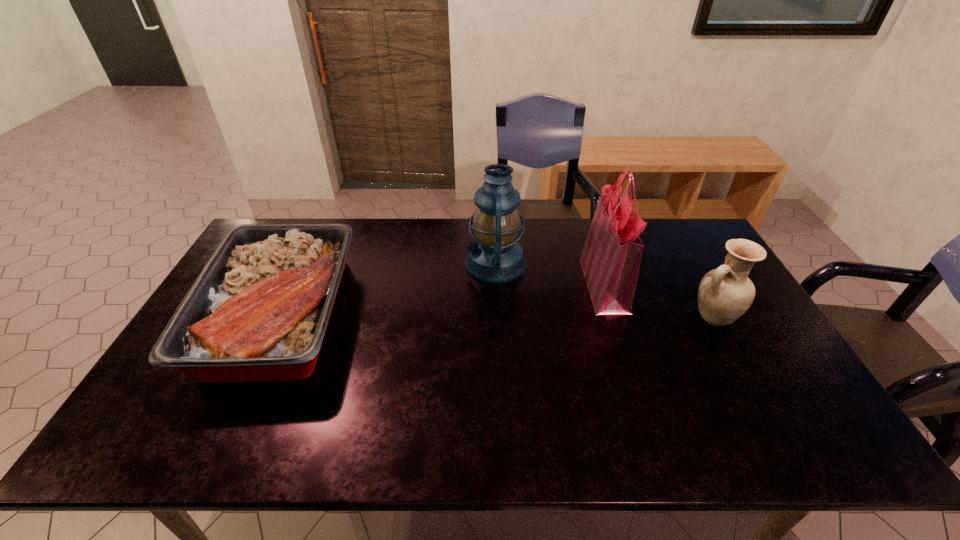
Find the location of a particular element. The image size is (960, 540). object that is the third closest to the shopping bag is located at coordinates (258, 311).

Locate an element on the screen. The image size is (960, 540). free location that satisfies the following two spatial constraints: 1. on the face of the lantern; 2. on the right side of the shopping bag is located at coordinates pyautogui.click(x=496, y=284).

The height and width of the screenshot is (540, 960). Identify the location of vacant space that satisfies the following two spatial constraints: 1. on the face of the third object from right to left; 2. on the left side of the shopping bag. (496, 284).

Where is `free point that satisfies the following two spatial constraints: 1. on the back side of the leftmost object; 2. on the left side of the second object from right to left`? free point that satisfies the following two spatial constraints: 1. on the back side of the leftmost object; 2. on the left side of the second object from right to left is located at coordinates (295, 284).

At what (x,y) coordinates should I click in order to perform the action: click on free location that satisfies the following two spatial constraints: 1. on the front side of the rightmost object; 2. on the left side of the shortest object. Please return your answer as a coordinate pair (x, y). Looking at the image, I should click on (278, 316).

At what (x,y) coordinates should I click in order to perform the action: click on free space that satisfies the following two spatial constraints: 1. on the front side of the second object from right to left; 2. on the left side of the rightmost object. Please return your answer as a coordinate pair (x, y). This screenshot has height=540, width=960. Looking at the image, I should click on (614, 316).

You are a GUI agent. You are given a task and a screenshot of the screen. Output one action in this format:
    pyautogui.click(x=<x>, y=<y>)
    Task: Click on the vacant area that satisfies the following two spatial constraints: 1. on the back side of the tray; 2. on the right side of the second object from right to left
    
    Given the screenshot: What is the action you would take?
    pyautogui.click(x=295, y=284)

At what (x,y) coordinates should I click in order to perform the action: click on vacant space that satisfies the following two spatial constraints: 1. on the face of the second object from left to right; 2. on the right side of the rightmost object. Please return your answer as a coordinate pair (x, y). The height and width of the screenshot is (540, 960). Looking at the image, I should click on (497, 316).